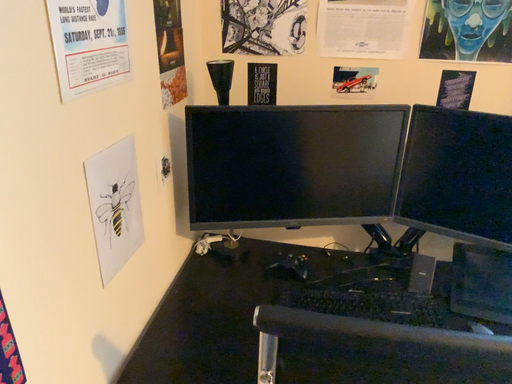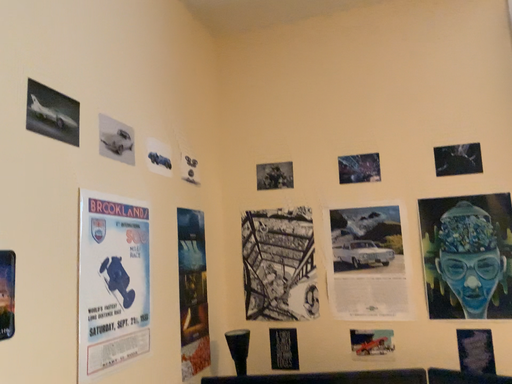
Question: Which way did the camera rotate in the video?

Choices:
 (A) rotated upward
 (B) rotated downward

Answer: (A)